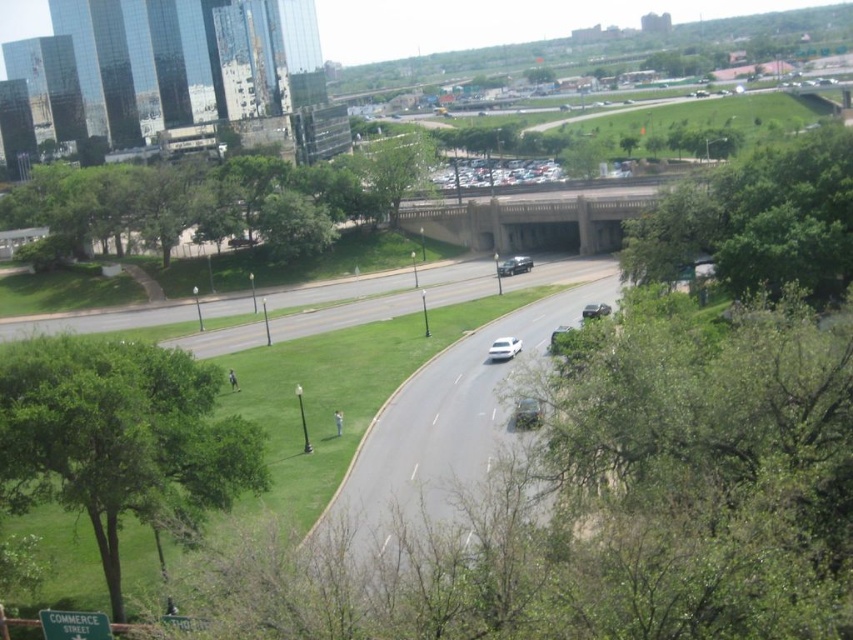
You are standing at the point labeled as point (444, 424) in the image. What type of surface are you currently standing on?

The point (444, 424) corresponds to the gray asphalt highway at center, so you are standing on a gray asphalt highway.

What is the exact coordinate of the gray asphalt highway at center?

The gray asphalt highway at center is located at the coordinate point of (444,424).

You are a pedestrian standing on the sidewalk next to the green leafy tree at upper left. You want to cross the road to reach the concrete bridge at center. Which direction should you walk to get to the bridge?

The green leafy tree at upper left is to the left of the concrete bridge at center, so you should walk to the right to reach the bridge.